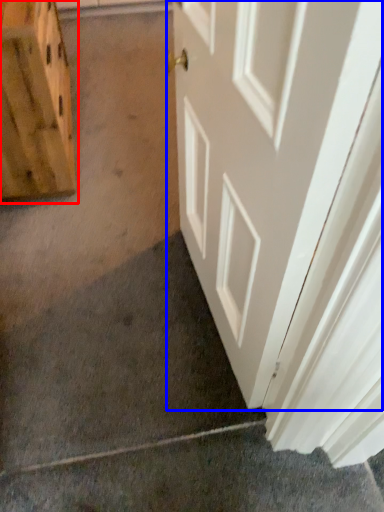
Question: Which of the following is the farthest to the observer, cabinetry (highlighted by a red box) or door (highlighted by a blue box)?

Choices:
 (A) cabinetry
 (B) door

Answer: (A)